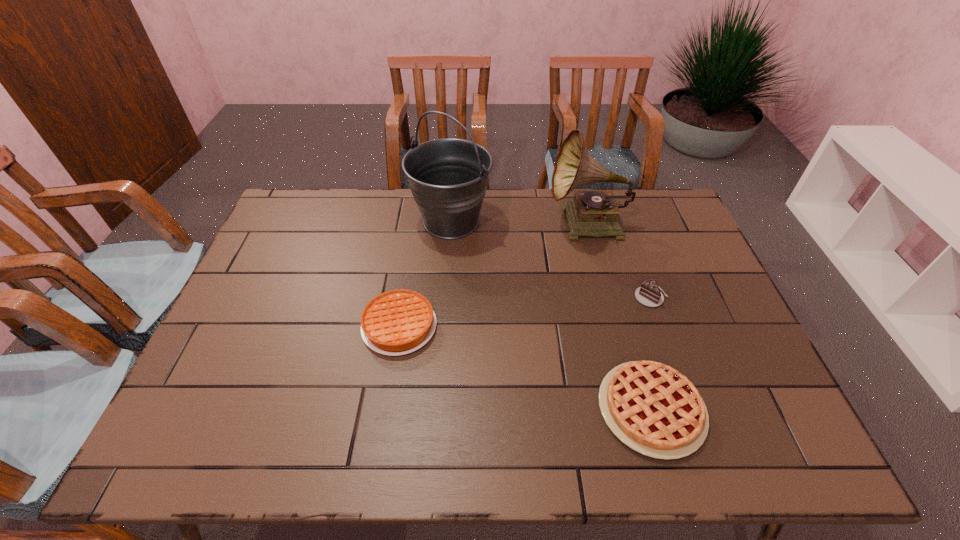
Locate an element on the screen. bucket is located at coordinates (448, 177).

At what (x,y) coordinates should I click in order to perform the action: click on record player. Please return your answer as a coordinate pair (x, y). This screenshot has height=540, width=960. Looking at the image, I should click on (595, 213).

Where is `the farther pie`? the farther pie is located at coordinates (397, 322).

Find the location of a particular element. The image size is (960, 540). chocolate cake is located at coordinates (648, 294).

Find the location of `the right pie`. the right pie is located at coordinates (652, 408).

You are a GUI agent. You are given a task and a screenshot of the screen. Output one action in this format:
    pyautogui.click(x=<x>, y=<y>)
    Task: Click on the nearer pie
    
    Given the screenshot: What is the action you would take?
    pyautogui.click(x=652, y=408)

Find the location of a particular element. free space located on the right of the bucket is located at coordinates (521, 221).

I want to click on free space located from the horn of the fourth shortest object, so click(x=494, y=225).

The image size is (960, 540). I want to click on vacant area located from the horn of the fourth shortest object, so click(435, 225).

At what (x,y) coordinates should I click in order to perform the action: click on vacant space located 0.330m from the horn of the fourth shortest object. Please return your answer as a coordinate pair (x, y). This screenshot has height=540, width=960. Looking at the image, I should click on (449, 225).